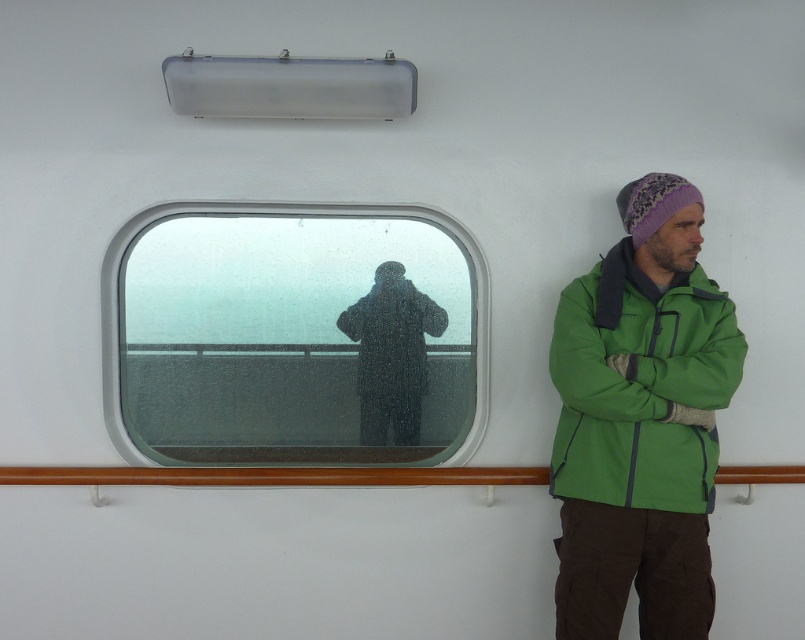
You are a passenger on a ship and need to exit through the nearest door. The clear glass window at center and the brown wood rail at center are in your way. Which object should you move around to avoid the larger obstacle?

The clear glass window at center has a larger size compared to brown wood rail at center, so you should move around the clear glass window at center to avoid the larger obstacle.

You are a passenger on a ship and want to check the weather outside. You see the clear glass window at center and the brown wood rail at center. Which object should you look through to see the outside clearly?

The clear glass window at center is taller than the brown wood rail at center, so you should look through the clear glass window at center to see the outside clearly since it is a window designed for viewing.

You are inside the ship and want to look outside through the clear glass window at center. Where should you position yourself to have the best view?

The clear glass window at center is located at point [295,333], so you should position yourself directly in front of this coordinate to have the best view.